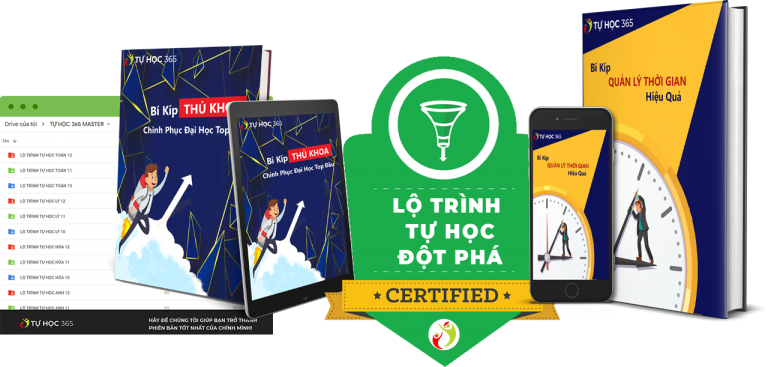
Where is `display`? Image resolution: width=768 pixels, height=367 pixels. display is located at coordinates (32, 149).